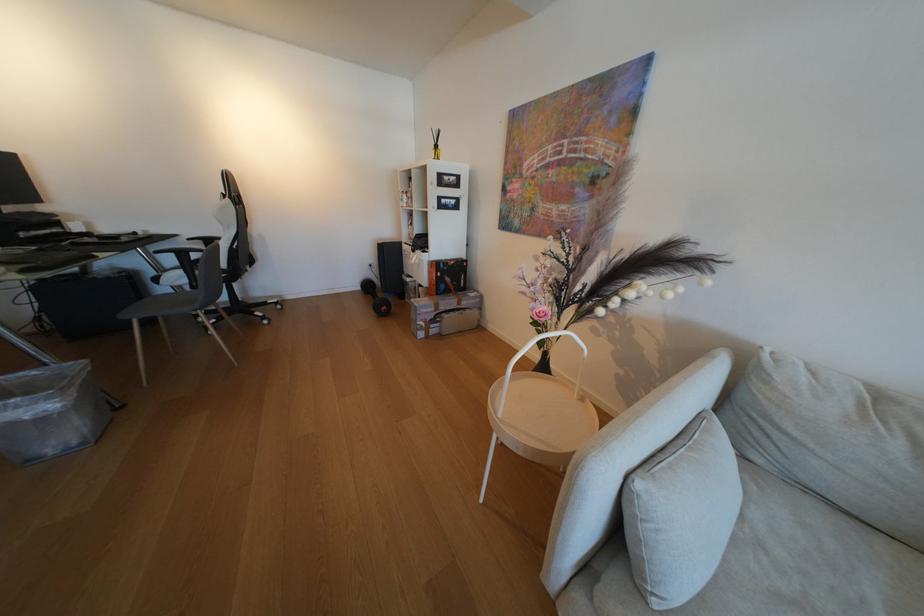
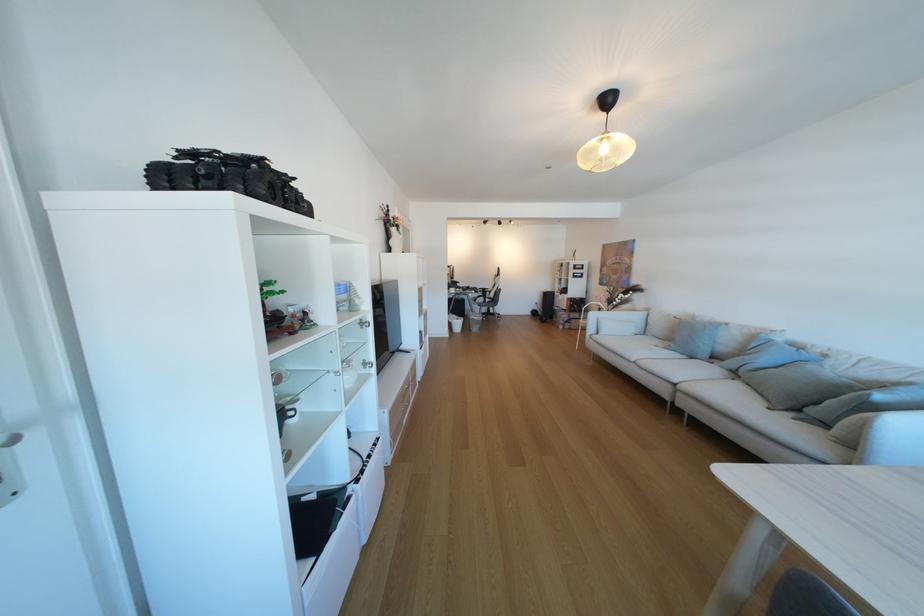
Where in the second image is the point corresponding to [464,289] from the first image?

(589, 310)